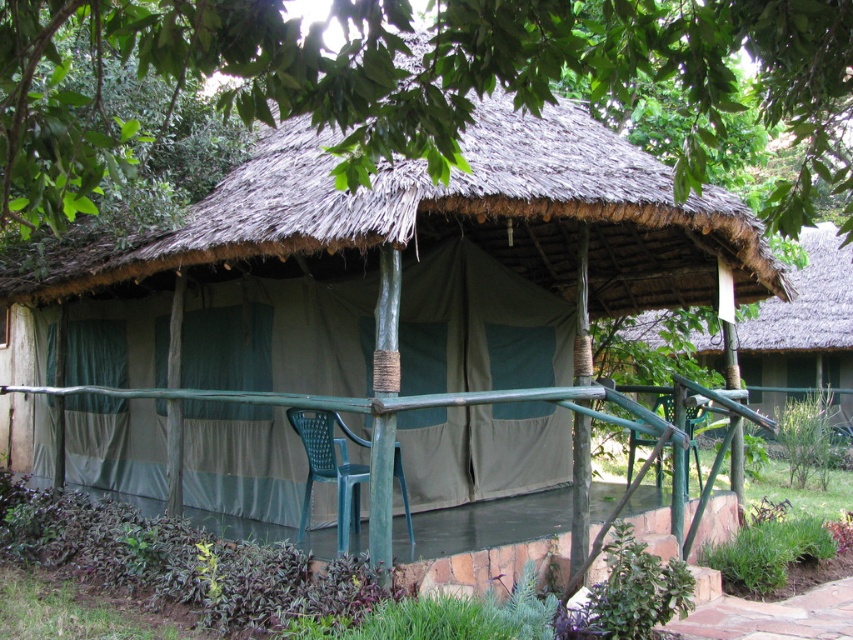
Is green leafy tree at upper center shorter than blue plastic chair at center?

Indeed, green leafy tree at upper center has a lesser height compared to blue plastic chair at center.

Is green leafy tree at upper center in front of blue plastic chair at center?

Yes, it is in front of blue plastic chair at center.

Is point (434, 180) closer to camera compared to point (399, 454)?

Yes.

The width and height of the screenshot is (853, 640). Find the location of `green leafy tree at upper center`. green leafy tree at upper center is located at coordinates (419, 81).

Which of these two, green leafy tree at upper center or green plastic chair at center, stands shorter?

With less height is green leafy tree at upper center.

Is green leafy tree at upper center taller than green plastic chair at center?

No.

Is point (556, 24) positioned before point (699, 476)?

Yes, point (556, 24) is in front of point (699, 476).

Where is `green leafy tree at upper center`? Image resolution: width=853 pixels, height=640 pixels. green leafy tree at upper center is located at coordinates (419, 81).

What do you see at coordinates (329, 467) in the screenshot? I see `blue plastic chair at center` at bounding box center [329, 467].

Between blue plastic chair at center and green plastic chair at center, which one appears on the right side from the viewer's perspective?

Positioned to the right is green plastic chair at center.

Locate an element on the screen. This screenshot has width=853, height=640. blue plastic chair at center is located at coordinates (329, 467).